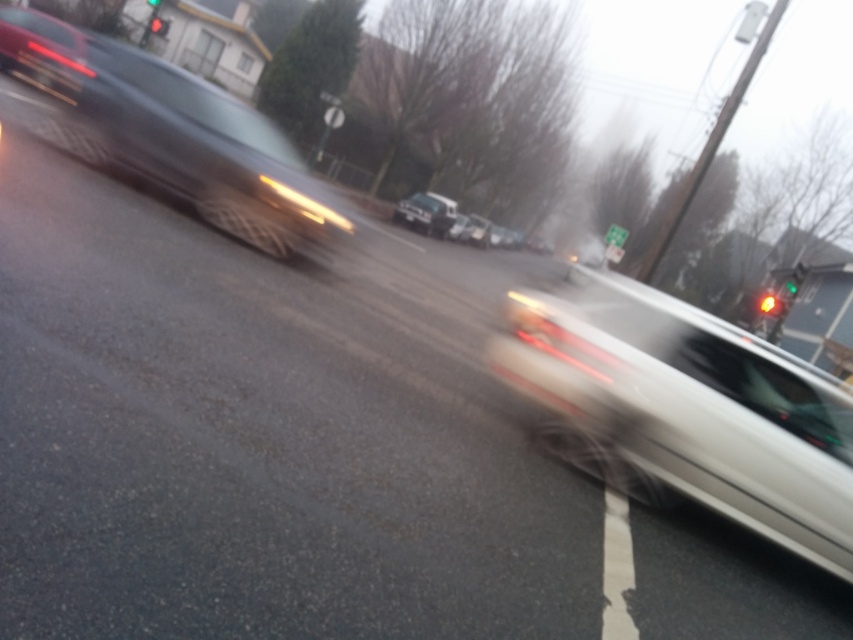
Question: Does satin silver sedan at right appear over amber glass traffic light at center?

Choices:
 (A) yes
 (B) no

Answer: (B)

Question: Which object is farther from the camera taking this photo?

Choices:
 (A) white matte truck at center
 (B) metallic silver car at left
 (C) amber glass traffic light at center
 (D) red glass traffic light at upper center

Answer: (D)

Question: Does matte black car at upper left have a larger size compared to green glass traffic light at upper right?

Choices:
 (A) no
 (B) yes

Answer: (B)

Question: Which point is farther from the camera taking this photo?

Choices:
 (A) (202, 182)
 (B) (439, 196)

Answer: (B)

Question: Among these points, which one is nearest to the camera?

Choices:
 (A) (142, 108)
 (B) (804, 276)
 (C) (44, 84)
 (D) (154, 19)

Answer: (A)

Question: Is green glass traffic light at upper right to the left of red glass traffic light at upper center from the viewer's perspective?

Choices:
 (A) no
 (B) yes

Answer: (A)